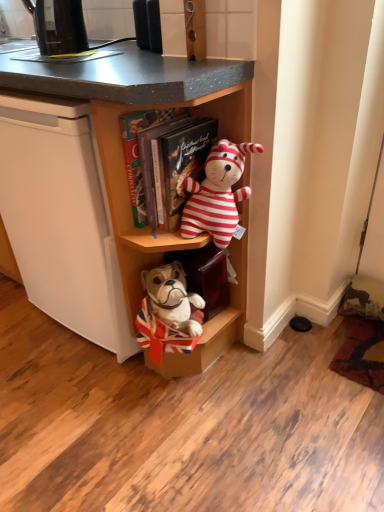
What is the approximate width of black plastic kettle at upper left?

black plastic kettle at upper left is 6.28 inches in width.

You are a GUI agent. You are given a task and a screenshot of the screen. Output one action in this format:
    pyautogui.click(x=<x>, y=<y>)
    Task: Click on the striped plush toy at center
    The image size is (384, 512).
    Given the screenshot: What is the action you would take?
    pyautogui.click(x=217, y=193)

From the image's perspective, which is below, striped plush toy at center or black plastic kettle at upper left?

striped plush toy at center.

This screenshot has width=384, height=512. In order to click on appliance above the striped plush toy at center (from the image's perspective) in this screenshot , I will do `click(58, 26)`.

In the scene shown: Can you tell me how much striped plush toy at center and black plastic kettle at upper left differ in facing direction?

There is a 5.02-degree angle between the facing directions of striped plush toy at center and black plastic kettle at upper left.

From a real-world perspective, is striped plush toy at center on top of wooden bookshelf at center?

Incorrect, from a real-world perspective, striped plush toy at center is lower than wooden bookshelf at center.

Can we say striped plush toy at center lies outside wooden bookshelf at center?

striped plush toy at center lies outside wooden bookshelf at center's area.

From the image's perspective, is striped plush toy at center over wooden bookshelf at center?

No, from the image's perspective, striped plush toy at center is not on top of wooden bookshelf at center.

Does striped plush toy at center have a greater height compared to wooden bookshelf at center?

In fact, striped plush toy at center may be shorter than wooden bookshelf at center.

Can striped plush toy at center be found inside wooden bookshelf at center?

No, wooden bookshelf at center does not contain striped plush toy at center.

Which of these two, wooden bookshelf at center or striped plush toy at center, is wider?

With larger width is striped plush toy at center.

Considering the relative positions of wooden bookshelf at center and striped plush toy at center in the image provided, is wooden bookshelf at center to the right of striped plush toy at center from the viewer's perspective?

No, wooden bookshelf at center is not to the right of striped plush toy at center.

The height and width of the screenshot is (512, 384). I want to click on toy located underneath the wooden bookshelf at center (from a real-world perspective), so click(x=217, y=193).

From a real-world perspective, is black plastic kettle at upper left located beneath striped plush toy at center?

No, from a real-world perspective, black plastic kettle at upper left is not beneath striped plush toy at center.

Between black plastic kettle at upper left and striped plush toy at center, which one has less height?

With less height is black plastic kettle at upper left.

How many degrees apart are the facing directions of black plastic kettle at upper left and striped plush toy at center?

The angular difference between black plastic kettle at upper left and striped plush toy at center is 5.02 degrees.

In the scene shown: Looking at their sizes, would you say black plastic kettle at upper left is wider or thinner than striped plush toy at center?

In the image, black plastic kettle at upper left appears to be more narrow than striped plush toy at center.

From a real-world perspective, is striped plush toy at center located beneath wooden cabinet at center?

No, from a real-world perspective, striped plush toy at center is not below wooden cabinet at center.

This screenshot has width=384, height=512. What are the coordinates of `toy above the wooden cabinet at center (from a real-world perspective)` in the screenshot? It's located at (217, 193).

Considering the points (237, 178) and (8, 245), which point is behind, point (237, 178) or point (8, 245)?

The point (8, 245) is behind.

Measure the distance from wooden cabinet at center to striped plush toy at center.

wooden cabinet at center is 7.26 inches away from striped plush toy at center.

Which object is positioned more to the left, wooden cabinet at center or striped plush toy at center?

Positioned to the left is wooden cabinet at center.

Is wooden cabinet at center not close to striped plush toy at center?

That's not correct — wooden cabinet at center is a little close to striped plush toy at center.

In terms of width, does wooden cabinet at center look wider or thinner when compared to striped plush toy at center?

Clearly, wooden cabinet at center has more width compared to striped plush toy at center.

From a real-world perspective, is black plastic kettle at upper left beneath wooden bookshelf at center?

No, from a real-world perspective, black plastic kettle at upper left is not below wooden bookshelf at center.

Considering the positions of objects black plastic kettle at upper left and wooden bookshelf at center in the image provided, who is behind, black plastic kettle at upper left or wooden bookshelf at center?

Positioned behind is black plastic kettle at upper left.

Can you confirm if black plastic kettle at upper left is shorter than wooden bookshelf at center?

Yes, black plastic kettle at upper left is shorter than wooden bookshelf at center.

Where is `appliance that appears above the striped plush toy at center (from the image's perspective)`? appliance that appears above the striped plush toy at center (from the image's perspective) is located at coordinates (58, 26).

Find the location of a particular element. cabinet in front of the striped plush toy at center is located at coordinates (162, 106).

Considering their positions, is wooden cabinet at center positioned closer to wooden bookshelf at center than striped plush toy at center?

wooden cabinet at center.

Based on their spatial positions, is wooden bookshelf at center or black plastic kettle at upper left closer to striped plush toy at center?

wooden bookshelf at center is positioned closer to the anchor striped plush toy at center.

Based on their spatial positions, is striped plush toy at center or black plastic kettle at upper left closer to wooden cabinet at center?

Among the two, striped plush toy at center is located nearer to wooden cabinet at center.

Considering their positions, is black plastic kettle at upper left positioned closer to wooden bookshelf at center than striped plush toy at center?

striped plush toy at center is closer to wooden bookshelf at center.

Based on their spatial positions, is wooden cabinet at center or black plastic kettle at upper left closer to striped plush toy at center?

The object closer to striped plush toy at center is wooden cabinet at center.

Looking at the image, which one is located closer to striped plush toy at center, black plastic kettle at upper left or wooden cabinet at center?

wooden cabinet at center is positioned closer to the anchor striped plush toy at center.

Estimate the real-world distances between objects in this image. Which object is further from striped plush toy at center, black plastic kettle at upper left or wooden bookshelf at center?

black plastic kettle at upper left is positioned further to the anchor striped plush toy at center.

From the image, which object appears to be nearer to wooden bookshelf at center, wooden cabinet at center or black plastic kettle at upper left?

wooden cabinet at center is closer to wooden bookshelf at center.

Where is `cabinet between black plastic kettle at upper left and striped plush toy at center in the up-down direction`? This screenshot has height=512, width=384. cabinet between black plastic kettle at upper left and striped plush toy at center in the up-down direction is located at coordinates (162, 106).

Locate an element on the screen. cabinetry between black plastic kettle at upper left and striped plush toy at center in the vertical direction is located at coordinates (140, 109).

Locate an element on the screen. This screenshot has width=384, height=512. cabinet between black plastic kettle at upper left and wooden cabinet at center in the up-down direction is located at coordinates (162, 106).

You are a GUI agent. You are given a task and a screenshot of the screen. Output one action in this format:
    pyautogui.click(x=<x>, y=<y>)
    Task: Click on the cabinet situated between wooden cabinet at center and striped plush toy at center from left to right
    
    Given the screenshot: What is the action you would take?
    pyautogui.click(x=162, y=106)